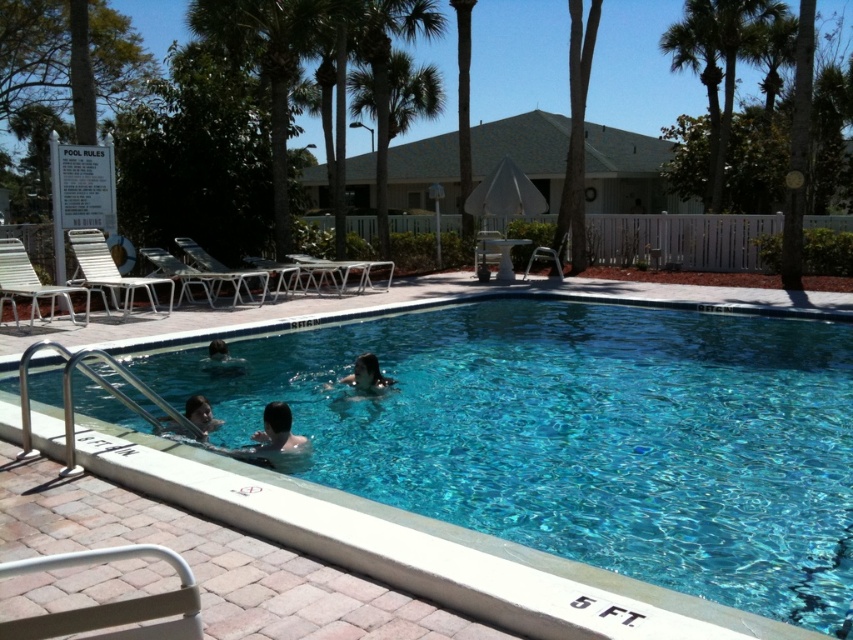
You are standing on the pool deck and want to find the clear blue water at center. Which direction should you look relative to the green leafy palm tree at center?

The clear blue water at center is located below the green leafy palm tree at center, so you should look downward towards the pool area beneath the palm tree.

You are standing on the pool deck and want to walk from the green leafy palm tree at center to the smooth skin person at lower left. Which direction should you walk to get closer to them?

You should walk towards the direction away from the viewer because the green leafy palm tree at center is further away than the smooth skin person at lower left, so moving towards the viewer would bring you closer to the smooth skin person at lower left.